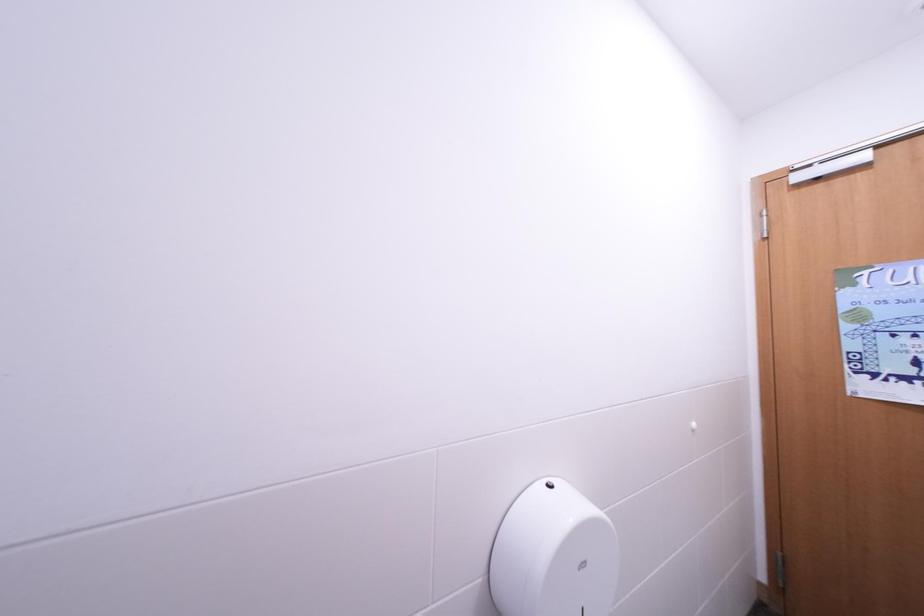
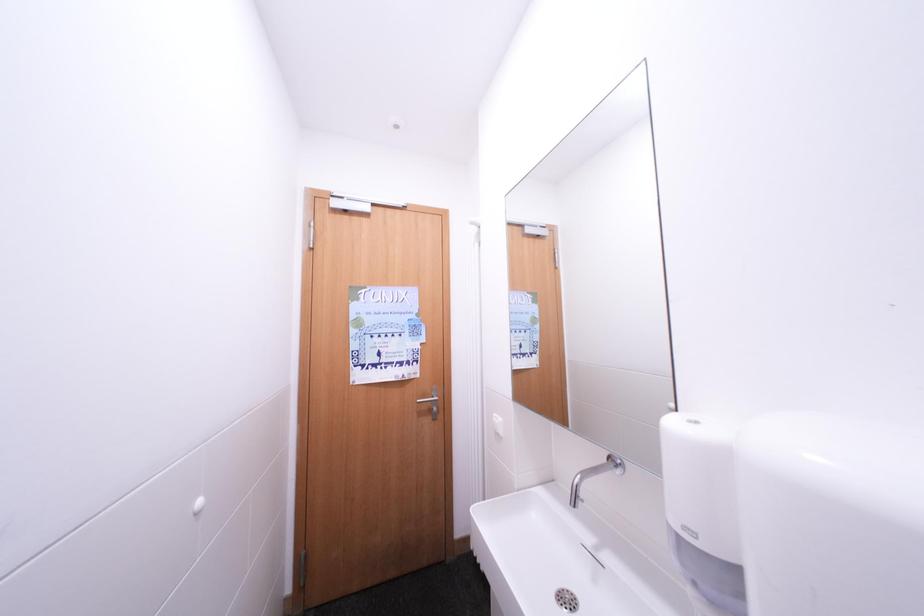
Question: The camera is either moving clockwise (left) or counter-clockwise (right) around the object. The first image is from the beginning of the video and the second image is from the end. Is the camera moving left or right when shooting the video?

Choices:
 (A) Left
 (B) Right

Answer: (A)